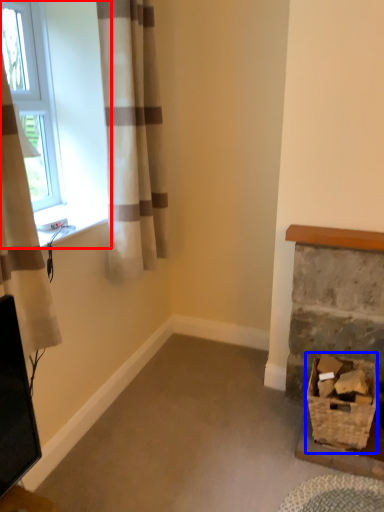
Question: Which object is closer to the camera taking this photo, window (highlighted by a red box) or basket (highlighted by a blue box)?

Choices:
 (A) window
 (B) basket

Answer: (B)